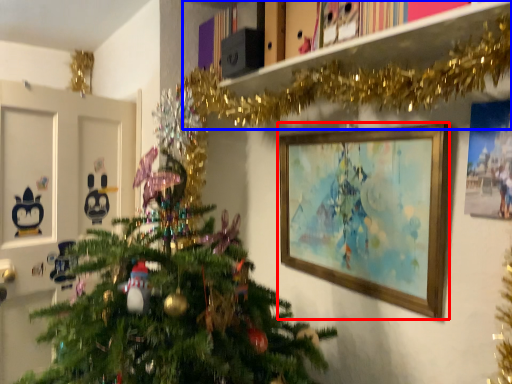
Question: Which object is further to the camera taking this photo, picture frame (highlighted by a red box) or bookshelf (highlighted by a blue box)?

Choices:
 (A) picture frame
 (B) bookshelf

Answer: (A)